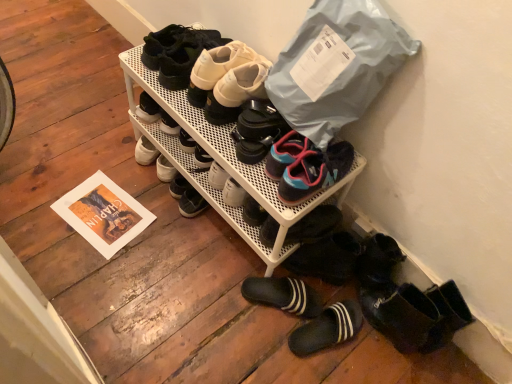
Question: Would you say white mesh shoe rack at center, the 5th footwear ordered from the bottom, is a long distance from white matte sneakers at upper center, positioned as the 2th footwear in top-to-bottom order?

Choices:
 (A) yes
 (B) no

Answer: (B)

Question: Considering the relative sizes of white mesh shoe rack at center, which is counted as the fourth footwear, starting from the top, and white matte sneakers at upper center, which is the seventh footwear in bottom-to-top order, in the image provided, is white mesh shoe rack at center, which is counted as the fourth footwear, starting from the top, shorter than white matte sneakers at upper center, which is the seventh footwear in bottom-to-top order,?

Choices:
 (A) yes
 (B) no

Answer: (B)

Question: Does white mesh shoe rack at center, the 5th footwear ordered from the bottom, have a larger size compared to white matte sneakers at upper center, positioned as the 2th footwear in top-to-bottom order?

Choices:
 (A) yes
 (B) no

Answer: (A)

Question: Is white mesh shoe rack at center, which is counted as the fourth footwear, starting from the top, to the right of white matte sneakers at upper center, which is the seventh footwear in bottom-to-top order, from the viewer's perspective?

Choices:
 (A) no
 (B) yes

Answer: (B)

Question: From a real-world perspective, is white mesh shoe rack at center, which is counted as the fourth footwear, starting from the top, located beneath white matte sneakers at upper center, which is the seventh footwear in bottom-to-top order?

Choices:
 (A) yes
 (B) no

Answer: (A)

Question: Does white mesh shoe rack at center, the 5th footwear ordered from the bottom, appear on the left side of white matte sneakers at upper center, positioned as the 2th footwear in top-to-bottom order?

Choices:
 (A) no
 (B) yes

Answer: (A)

Question: Does matte black shoes at upper center, acting as the eighth footwear starting from the bottom, contain blue mesh sneakers at center, acting as the sixth footwear starting from the top?

Choices:
 (A) yes
 (B) no

Answer: (B)

Question: Considering the relative sizes of matte black shoes at upper center, marked as the first footwear in a top-to-bottom arrangement, and blue mesh sneakers at center, acting as the sixth footwear starting from the top, in the image provided, is matte black shoes at upper center, marked as the first footwear in a top-to-bottom arrangement, bigger than blue mesh sneakers at center, acting as the sixth footwear starting from the top,?

Choices:
 (A) yes
 (B) no

Answer: (B)

Question: Can you confirm if matte black shoes at upper center, marked as the first footwear in a top-to-bottom arrangement, is positioned to the left of blue mesh sneakers at center, positioned as the 3th footwear in bottom-to-top order?

Choices:
 (A) no
 (B) yes

Answer: (B)

Question: Is matte black shoes at upper center, marked as the first footwear in a top-to-bottom arrangement, looking in the opposite direction of blue mesh sneakers at center, acting as the sixth footwear starting from the top?

Choices:
 (A) no
 (B) yes

Answer: (A)

Question: Is matte black shoes at upper center, marked as the first footwear in a top-to-bottom arrangement, positioned behind blue mesh sneakers at center, positioned as the 3th footwear in bottom-to-top order?

Choices:
 (A) no
 (B) yes

Answer: (B)

Question: Does matte black shoes at upper center, marked as the first footwear in a top-to-bottom arrangement, have a greater width compared to blue mesh sneakers at center, acting as the sixth footwear starting from the top?

Choices:
 (A) yes
 (B) no

Answer: (B)

Question: Can we say white matte sneakers at upper center, positioned as the 2th footwear in top-to-bottom order, lies outside matte black shoes at upper center, acting as the eighth footwear starting from the bottom?

Choices:
 (A) no
 (B) yes

Answer: (B)